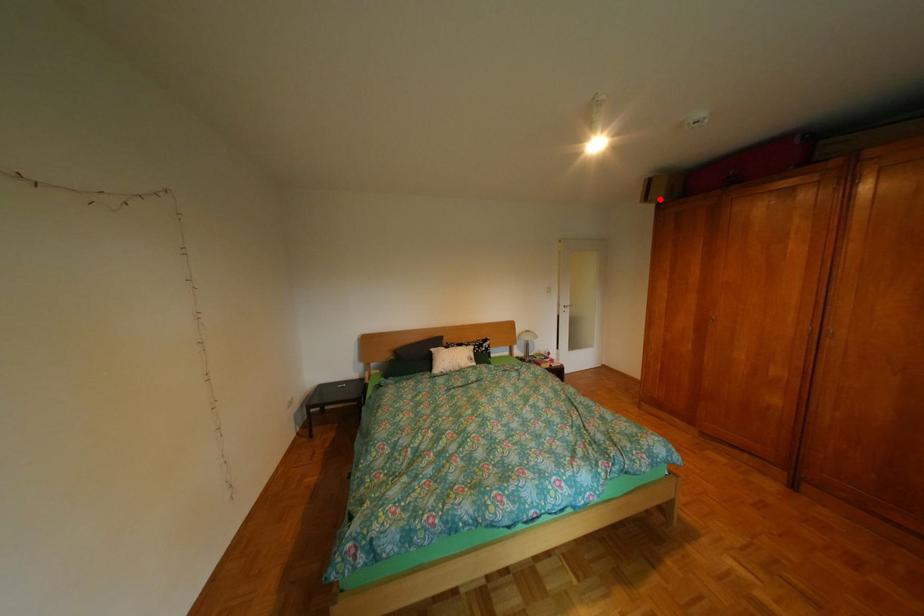
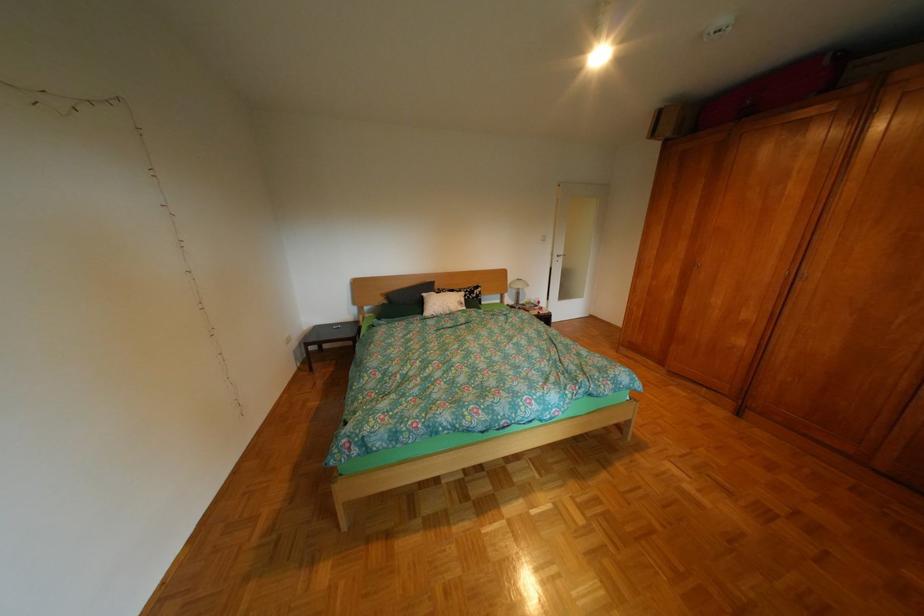
Question: I am providing you with two images of the same scene from different viewpoints. A red point is marked on the first image. At the location where the point appears in image 1, is it still visible in image 2?

Choices:
 (A) Yes
 (B) No

Answer: (A)